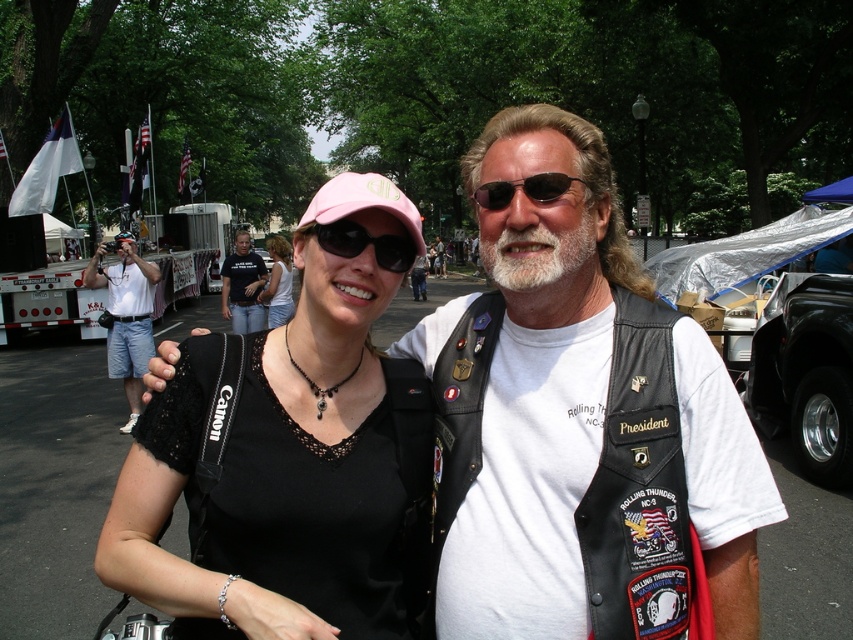
Question: Which object is the closest to the black cotton t-shirt at center?

Choices:
 (A) leather vest at center
 (B) black fabric shirt at center
 (C) whitehairbeard at center

Answer: (B)

Question: Estimate the real-world distances between objects in this image. Which object is closer to the black cotton t-shirt at center?

Choices:
 (A) black fabric shirt at center
 (B) leather vest at center
 (C) pink fabric baseball cap at center
 (D) matte black cap at center

Answer: (D)

Question: Can you confirm if whitehairbeard at center is smaller than matte black sunglasses at center?

Choices:
 (A) no
 (B) yes

Answer: (A)

Question: Considering the relative positions of leather vest at center and sunglasses at center in the image provided, where is leather vest at center located with respect to sunglasses at center?

Choices:
 (A) right
 (B) left

Answer: (A)

Question: Can you confirm if whitehairbeard at center is smaller than pink fabric baseball cap at center?

Choices:
 (A) yes
 (B) no

Answer: (A)

Question: Among these points, which one is nearest to the camera?

Choices:
 (A) (171, 353)
 (B) (349, 250)
 (C) (128, 269)

Answer: (B)